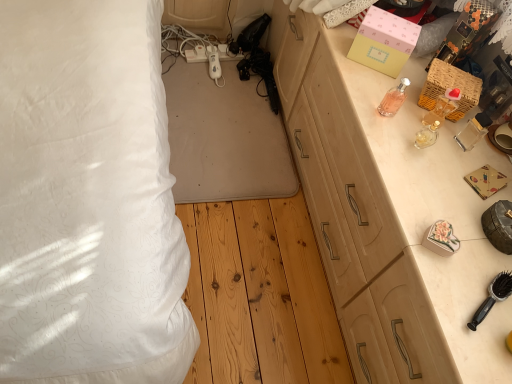
The height and width of the screenshot is (384, 512). I want to click on vacant space that's between pink glass bottle at upper right, positioned as the 3th perfume in right-to-left order, and pink matte box at upper right, placed as the first box when sorted from left to right, so click(369, 81).